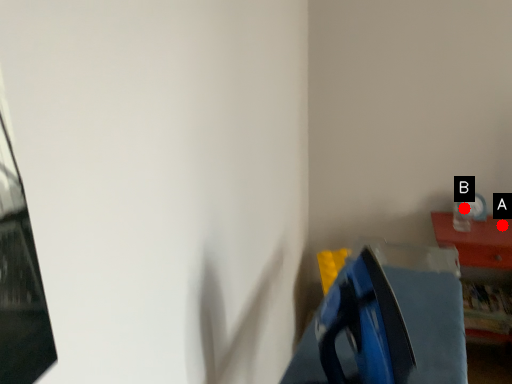
Question: Two points are circled on the image, labeled by A and B beside each circle. Which point is further to the camera?

Choices:
 (A) A is further
 (B) B is further

Answer: (B)